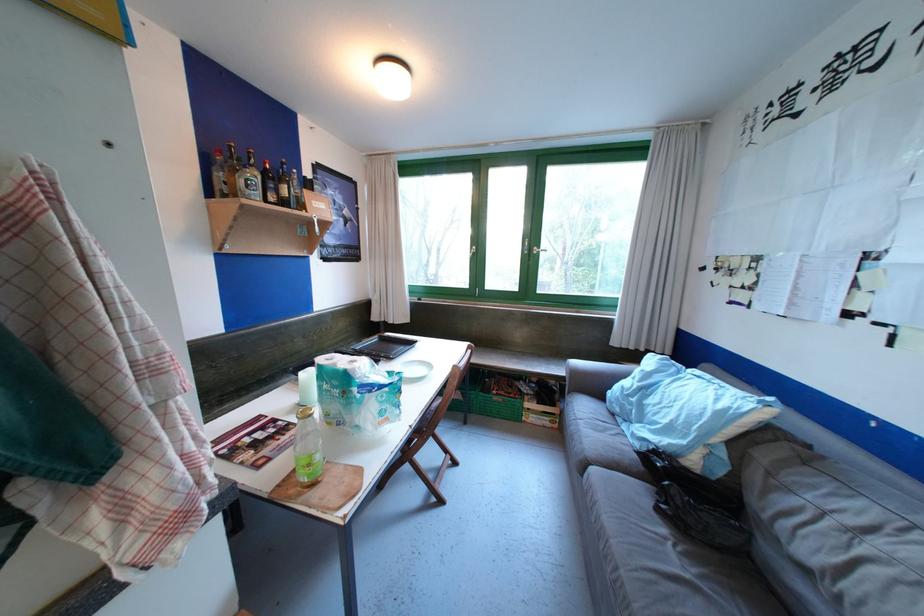
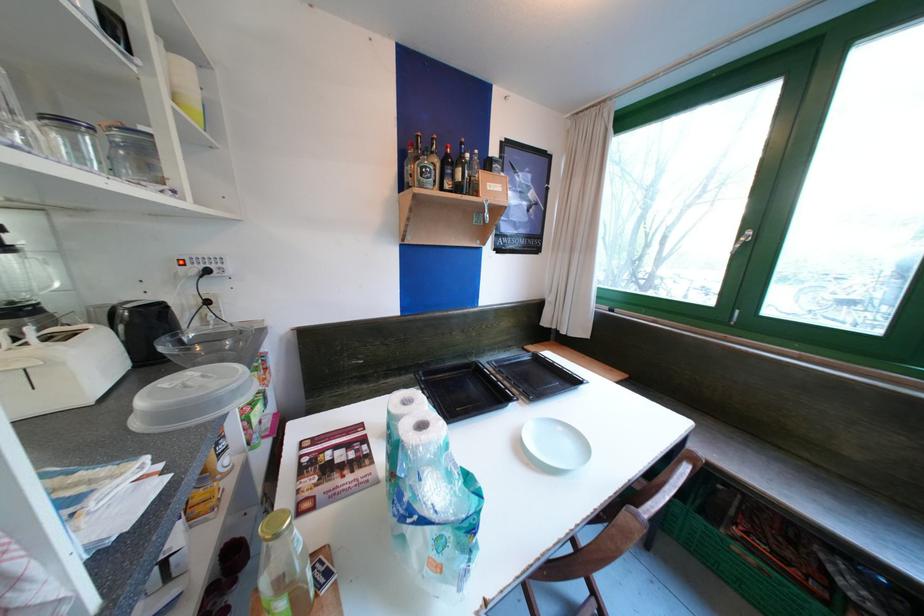
In the second image, find the point that corresponds to pixel 359 363 in the first image.

(430, 428)